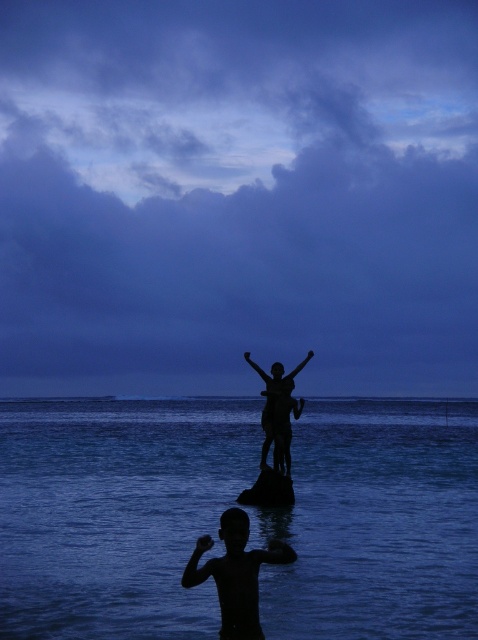
Is dark blue water at center to the right of silhouette statue at center from the viewer's perspective?

No, dark blue water at center is not to the right of silhouette statue at center.

Who is more distant from viewer, (355, 500) or (312, 353)?

Point (355, 500)

Where is `dark blue water at center`? dark blue water at center is located at coordinates (116, 512).

Can you confirm if black skin boy at lower center is thinner than silhouette statue at center?

Incorrect, black skin boy at lower center's width is not less than silhouette statue at center's.

Is black skin boy at lower center bigger than silhouette statue at center?

Indeed, black skin boy at lower center has a larger size compared to silhouette statue at center.

The width and height of the screenshot is (478, 640). Identify the location of black skin boy at lower center. (236, 573).

You are a GUI agent. You are given a task and a screenshot of the screen. Output one action in this format:
    pyautogui.click(x=<x>, y=<y>)
    Task: Click on the black skin boy at lower center
    
    Given the screenshot: What is the action you would take?
    pyautogui.click(x=236, y=573)

Is point (162, 572) farther from viewer compared to point (223, 637)?

Yes, point (162, 572) is farther from viewer.

Between dark blue water at center and black skin boy at lower center, which one appears on the left side from the viewer's perspective?

From the viewer's perspective, dark blue water at center appears more on the left side.

Based on the photo, who is more forward, (94, 468) or (281, 557)?

Point (281, 557) is in front.

You are a GUI agent. You are given a task and a screenshot of the screen. Output one action in this format:
    pyautogui.click(x=<x>, y=<y>)
    Task: Click on the dark blue water at center
    
    Given the screenshot: What is the action you would take?
    (x=116, y=512)